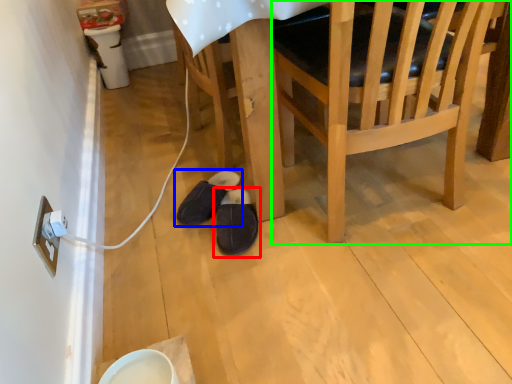
Question: Based on their relative distances, which object is nearer to footwear (highlighted by a red box)? Choose from footwear (highlighted by a blue box) and chair (highlighted by a green box).

Choices:
 (A) footwear
 (B) chair

Answer: (A)